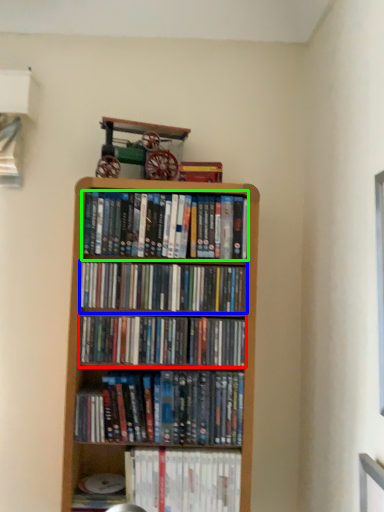
Question: Which object is positioned closest to book (highlighted by a red box)? Select from book (highlighted by a blue box) and book (highlighted by a green box).

Choices:
 (A) book
 (B) book

Answer: (A)